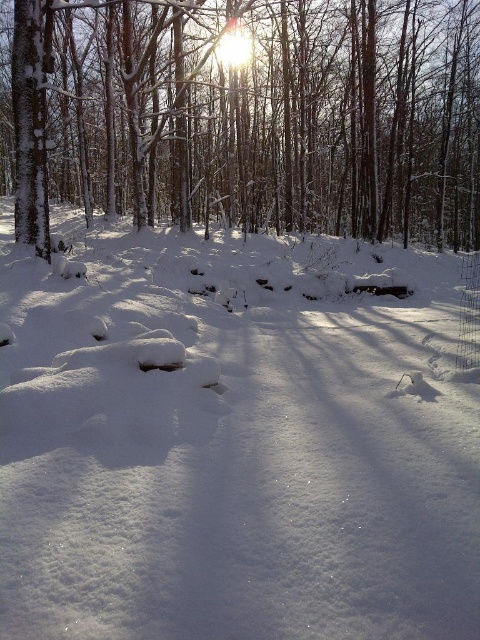
Question: Which object is farther from the camera taking this photo?

Choices:
 (A) white fluffy snow at center
 (B) snow-covered tree at upper left

Answer: (B)

Question: Is white fluffy snow at center to the right of snow-covered tree at upper left from the viewer's perspective?

Choices:
 (A) no
 (B) yes

Answer: (B)

Question: Can you confirm if white fluffy snow at center is positioned below snow-covered tree at upper left?

Choices:
 (A) no
 (B) yes

Answer: (B)

Question: Is white fluffy snow at center positioned in front of snow-covered tree at upper left?

Choices:
 (A) no
 (B) yes

Answer: (B)